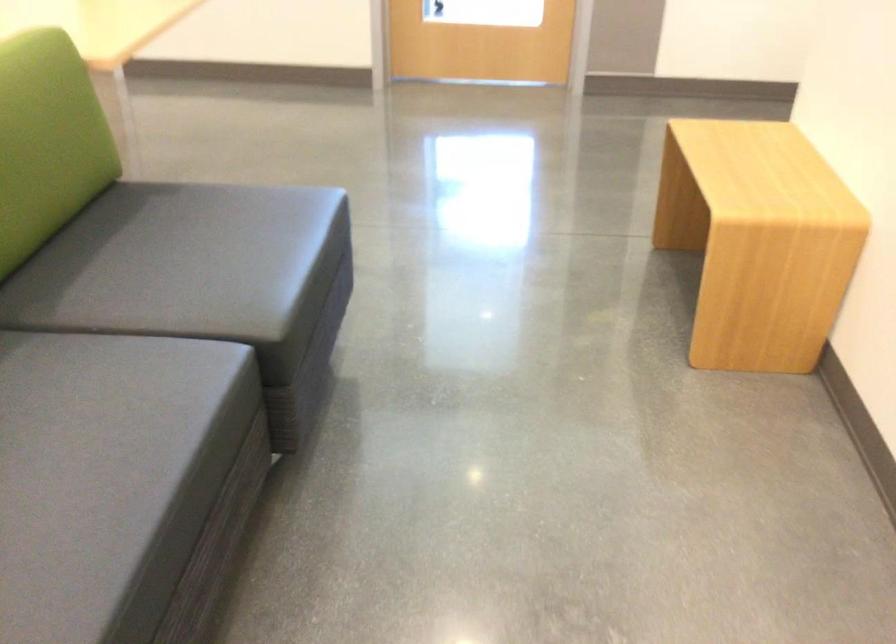
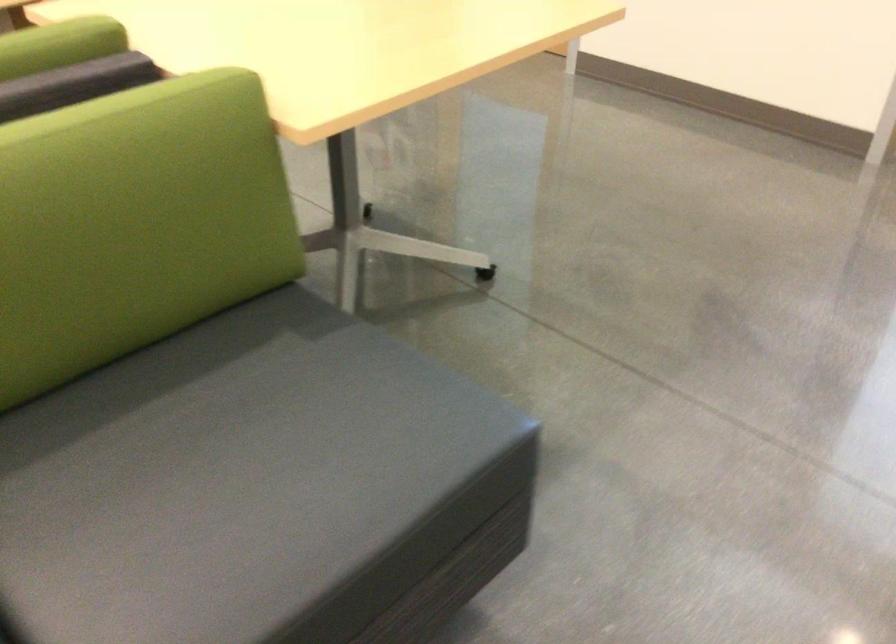
In the second image, find the point that corresponds to (238,247) in the first image.

(259, 488)